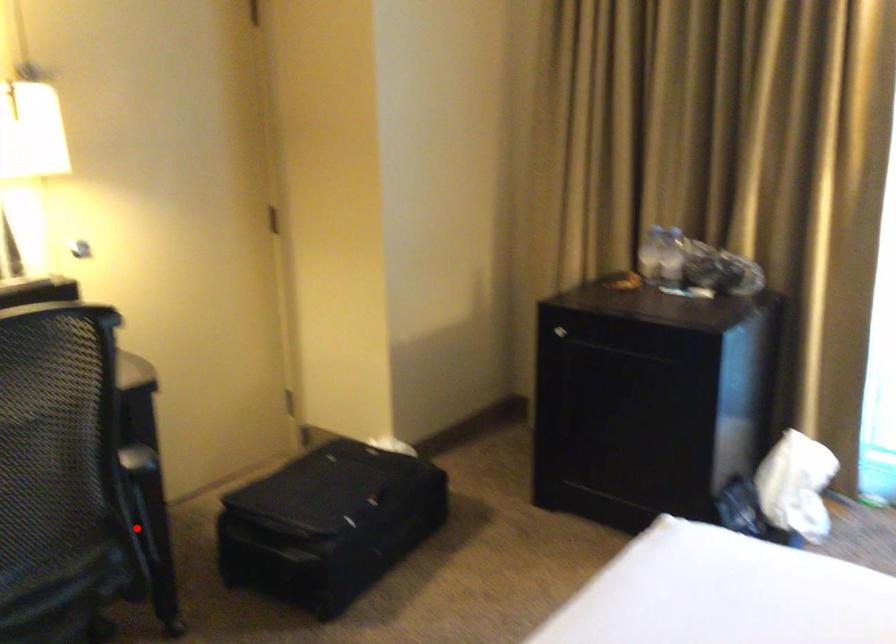
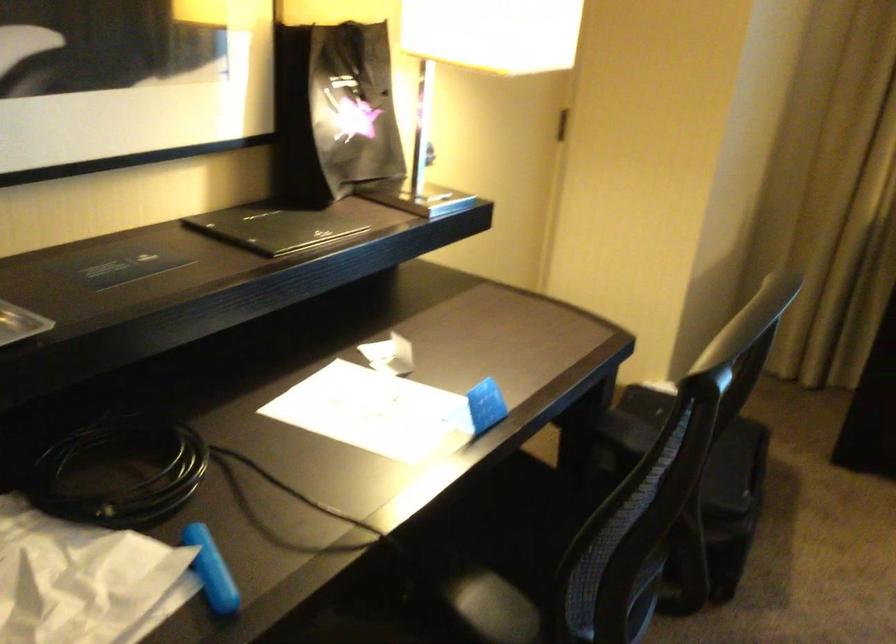
Question: I am providing you with two images of the same scene from different viewpoints. A red point is marked on the first image. Can you still see the location of the red point in image 2?

Choices:
 (A) Yes
 (B) No

Answer: (B)